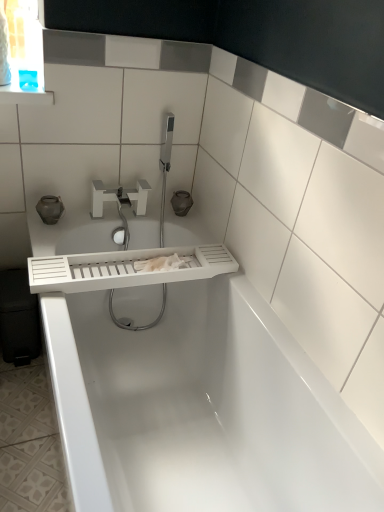
Question: From a real-world perspective, is white plastic tap at upper center positioned above or below white glossy bathtub at center?

Choices:
 (A) above
 (B) below

Answer: (A)

Question: Which is correct: white plastic tap at upper center is inside white glossy bathtub at center, or outside of it?

Choices:
 (A) outside
 (B) inside

Answer: (A)

Question: Estimate the real-world distances between objects in this image. Which object is closer to the white matte tray at center?

Choices:
 (A) white plastic tap at upper center
 (B) white glossy bathtub at center

Answer: (B)

Question: Considering the real-world distances, which object is closest to the white plastic tap at upper center?

Choices:
 (A) white glossy bathtub at center
 (B) white matte tray at center

Answer: (B)